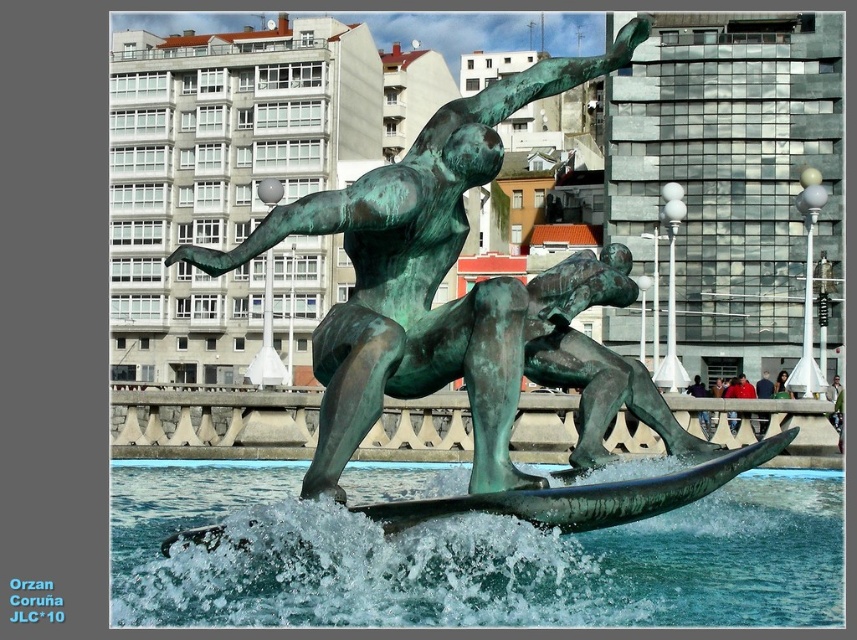
Does greenish-blue water at center have a lesser width compared to green patina bronze statue at center?

Correct, greenish-blue water at center's width is less than green patina bronze statue at center's.

Can you confirm if greenish-blue water at center is wider than green patina bronze statue at center?

In fact, greenish-blue water at center might be narrower than green patina bronze statue at center.

Locate an element on the screen. This screenshot has height=640, width=857. greenish-blue water at center is located at coordinates (468, 557).

This screenshot has width=857, height=640. Find the location of `greenish-blue water at center`. greenish-blue water at center is located at coordinates (468, 557).

From the picture: Which is below, greenish-blue water at center or green patina surfboard at center?

Positioned lower is greenish-blue water at center.

Looking at this image, which of these two, greenish-blue water at center or green patina surfboard at center, stands shorter?

green patina surfboard at center

Between point (742, 500) and point (655, 490), which one is positioned behind?

Point (742, 500)

Identify the location of greenish-blue water at center. (468, 557).

Between green patina bronze statue at center and green patina surfboard at center, which one is positioned higher?

green patina bronze statue at center is above.

Can you confirm if green patina bronze statue at center is smaller than green patina surfboard at center?

Incorrect, green patina bronze statue at center is not smaller in size than green patina surfboard at center.

Locate an element on the screen. The image size is (857, 640). green patina bronze statue at center is located at coordinates (418, 278).